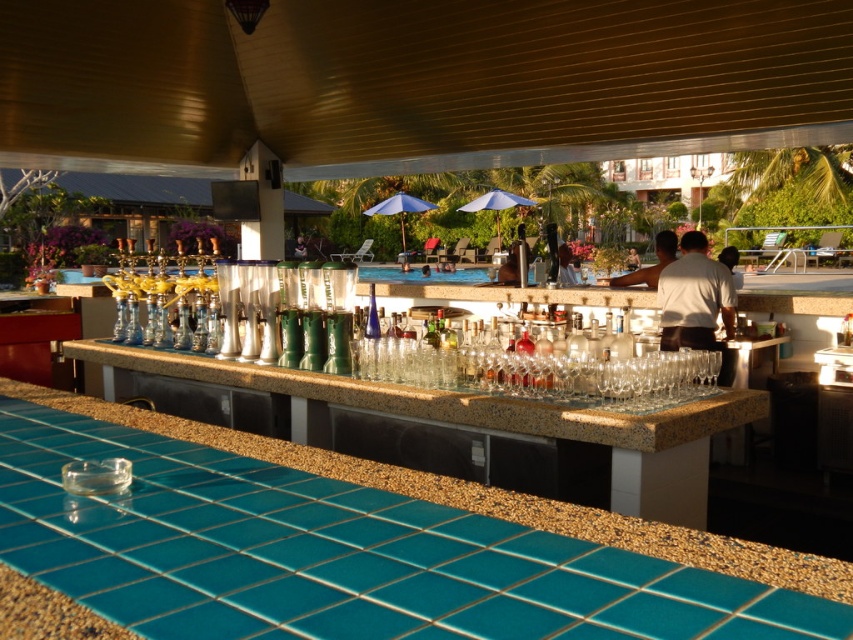
You are a guest at the resort and want to place your sunglasses on the teal tile countertop at lower left. However, there is a white matte shirt at center in the way. Can you easily reach the countertop from where you are standing?

The teal tile countertop at lower left is positioned under the white matte shirt at center, so you can easily reach it by moving around or under the shirt to access the countertop.

You are a bartender who needs to place a large tray of drinks on the teal tile countertop at lower left and the white matte shirt at center. Which surface can accommodate the tray without it hanging off the edge?

The teal tile countertop at lower left is wider than the white matte shirt at center, so the tray should be placed on the teal tile countertop at lower left to ensure it fits properly.

Consider the image. You are a guest at the resort and want to order a drink. You see the teal tile countertop at lower left and the white shirt at upper center. Which object is closer to you as you stand in front of the bar?

The teal tile countertop at lower left is closer to you because it is located below the white shirt at upper center, which is positioned higher up.